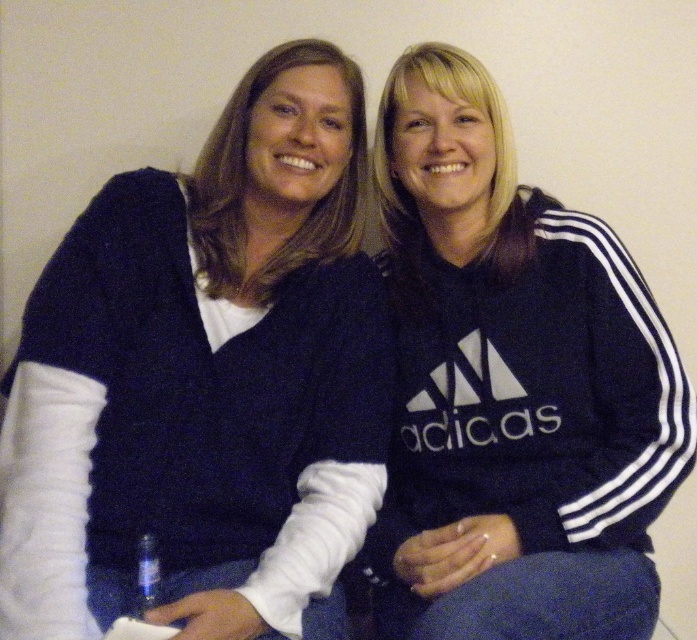
Question: Which of the following is the farthest from the observer?

Choices:
 (A) knitted dark blue sweater at left
 (B) navy blue hoodie at center

Answer: (A)

Question: Which point is farther to the camera?

Choices:
 (A) knitted dark blue sweater at left
 (B) navy blue hoodie at center

Answer: (A)

Question: Is knitted dark blue sweater at left positioned behind navy blue hoodie at center?

Choices:
 (A) no
 (B) yes

Answer: (B)

Question: Is knitted dark blue sweater at left to the right of navy blue hoodie at center from the viewer's perspective?

Choices:
 (A) yes
 (B) no

Answer: (B)

Question: From the image, what is the correct spatial relationship of knitted dark blue sweater at left in relation to navy blue hoodie at center?

Choices:
 (A) right
 (B) left

Answer: (B)

Question: Which of the following is the closest to the observer?

Choices:
 (A) knitted dark blue sweater at left
 (B) navy blue hoodie at center

Answer: (B)